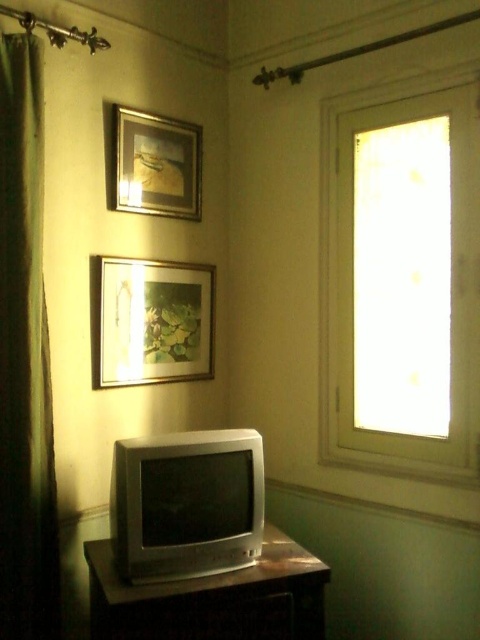
Question: Which object is farther from the camera taking this photo?

Choices:
 (A) metallic silver dresser at lower center
 (B) wooden frame at upper center
 (C) green fabric curtain at left

Answer: (B)

Question: Estimate the real-world distances between objects in this image. Which object is farther from the metallic silver dresser at lower center?

Choices:
 (A) matte wooden picture frame at center
 (B) transparent glass window at upper right

Answer: (B)

Question: Can you confirm if transparent glass window at upper right is wider than metallic silver dresser at lower center?

Choices:
 (A) yes
 (B) no

Answer: (B)

Question: Can you confirm if green fabric curtain at left is bigger than metallic silver dresser at lower center?

Choices:
 (A) no
 (B) yes

Answer: (A)

Question: From the image, what is the correct spatial relationship of transparent glass window at upper right in relation to wooden frame at upper center?

Choices:
 (A) below
 (B) above

Answer: (A)

Question: Which object is farther from the camera taking this photo?

Choices:
 (A) wooden frame at upper center
 (B) transparent glass window at upper right

Answer: (A)